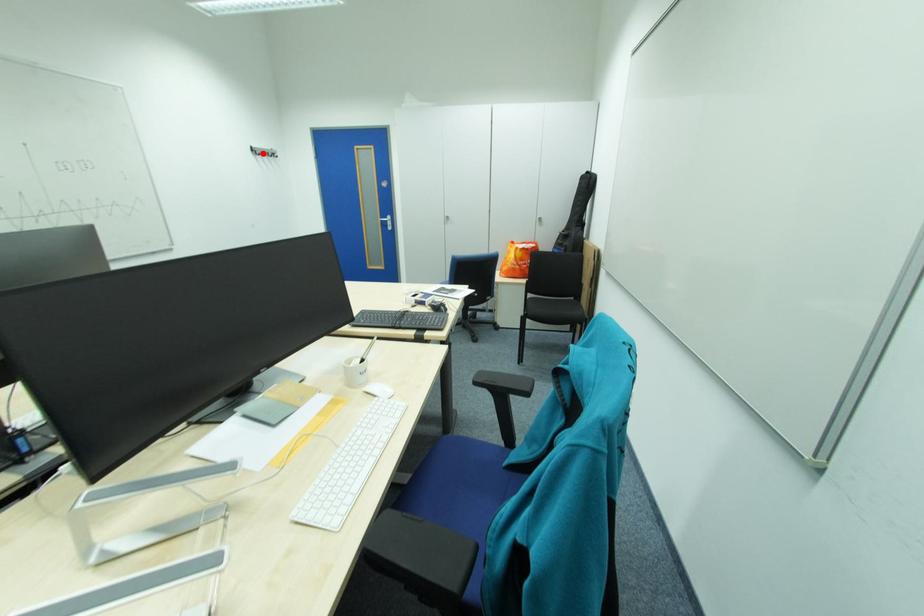
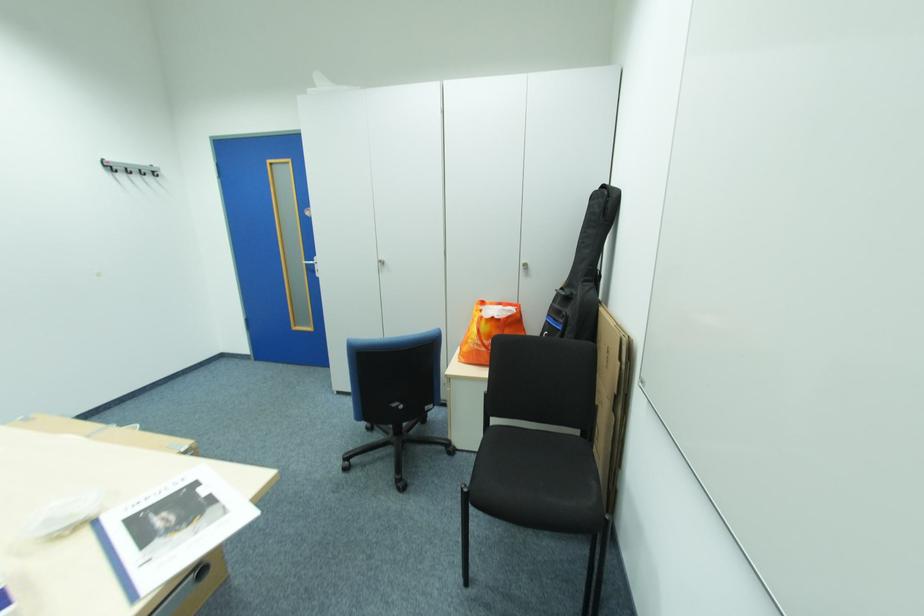
Locate, in the second image, the point that corresponds to the highlighted location in the first image.

(114, 171)